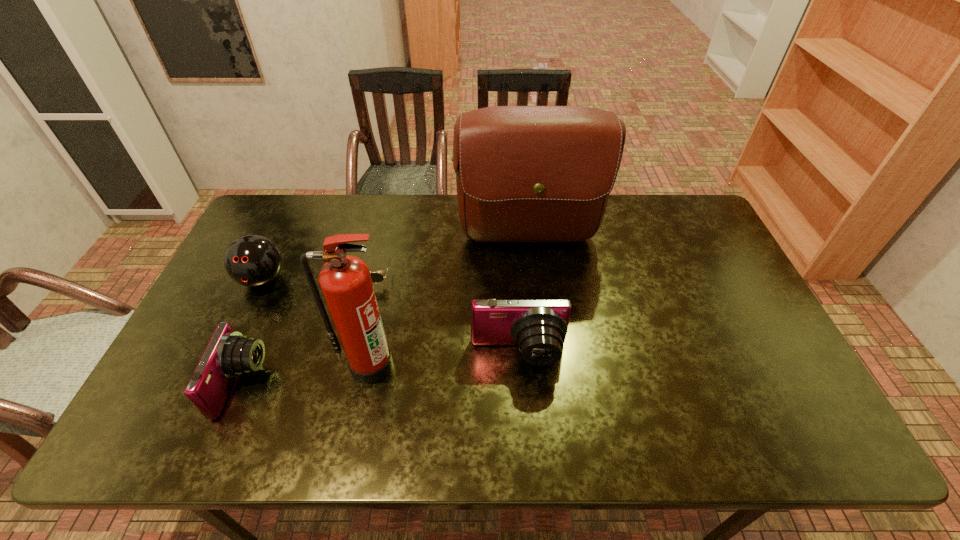
You are a GUI agent. You are given a task and a screenshot of the screen. Output one action in this format:
    pyautogui.click(x=<x>, y=<y>)
    Task: Click on the vacant space situated 0.070m on the front lenses of the sunglasses
    Image resolution: width=960 pixels, height=540 pixels.
    Given the screenshot: What is the action you would take?
    pyautogui.click(x=361, y=306)

You are a GUI agent. You are given a task and a screenshot of the screen. Output one action in this format:
    pyautogui.click(x=<x>, y=<y>)
    Task: Click on the object that is at the far edge
    
    Given the screenshot: What is the action you would take?
    pyautogui.click(x=523, y=173)

The image size is (960, 540). Find the location of `fire extinguisher at the near edge`. fire extinguisher at the near edge is located at coordinates (345, 280).

This screenshot has height=540, width=960. Identify the location of camera positioned at the left edge. (228, 354).

Where is `bowling ball at the left edge`? The image size is (960, 540). bowling ball at the left edge is located at coordinates (252, 260).

Locate an element on the screen. object that is at the near left corner is located at coordinates (228, 354).

The height and width of the screenshot is (540, 960). I want to click on free spot at the far edge of the desktop, so click(x=322, y=212).

Where is `vacant area at the near edge of the desktop`? This screenshot has height=540, width=960. vacant area at the near edge of the desktop is located at coordinates (418, 380).

What are the coordinates of `free space at the left edge of the desktop` in the screenshot? It's located at (188, 368).

Where is `free location at the right edge`? This screenshot has width=960, height=540. free location at the right edge is located at coordinates (731, 291).